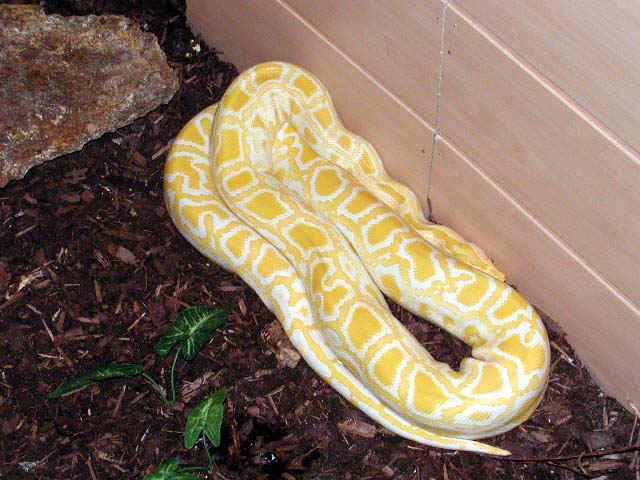
The height and width of the screenshot is (480, 640). Find the location of `wall`. wall is located at coordinates pyautogui.click(x=463, y=78).